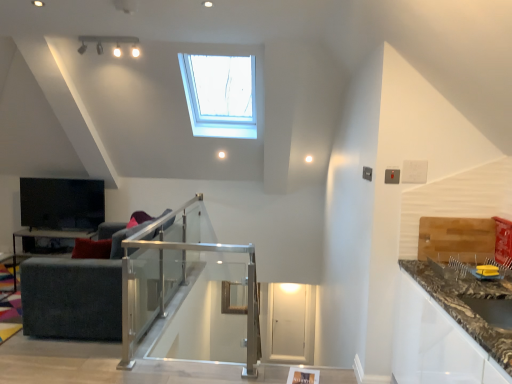
What is the approximate width of matte black table at lower left?

matte black table at lower left is 50.41 centimeters in width.

Measure the distance between dark gray fabric couch at left and camera.

A distance of 10.66 feet exists between dark gray fabric couch at left and camera.

Locate an element on the screen. The width and height of the screenshot is (512, 384). matte black table at lower left is located at coordinates (49, 235).

Locate an element on the screen. glass door behind the dark gray fabric couch at left is located at coordinates (288, 319).

Which of these two, dark gray fabric couch at left or transparent glass door at center, is smaller?

transparent glass door at center is smaller.

Is dark gray fabric couch at left in front of transparent glass door at center?

Yes.

From the image's perspective, would you say transparent glass door at center is shown under clear glass balustrade at center?

Yes, from the image's perspective, transparent glass door at center is beneath clear glass balustrade at center.

Can you tell me how much transparent glass door at center and clear glass balustrade at center differ in facing direction?

They differ by 1.38 degrees in their facing directions.

Who is shorter, transparent glass door at center or clear glass balustrade at center?

transparent glass door at center.

Is transparent glass door at center beside dark gray fabric couch at left?

No, transparent glass door at center is not making contact with dark gray fabric couch at left.

I want to click on glass door on the right of dark gray fabric couch at left, so click(x=288, y=319).

Is transparent glass door at center positioned with its back to dark gray fabric couch at left?

No, dark gray fabric couch at left is not at the back of transparent glass door at center.

Is transparent glass door at center thinner than dark gray fabric couch at left?

Indeed, transparent glass door at center has a lesser width compared to dark gray fabric couch at left.

From a real-world perspective, between clear glass balustrade at center and marble-patterned countertop at lower right, who is vertically higher?

marble-patterned countertop at lower right, from a real-world perspective.

Is clear glass balustrade at center beside marble-patterned countertop at lower right?

No, clear glass balustrade at center is not beside marble-patterned countertop at lower right.

How many degrees apart are the facing directions of clear glass balustrade at center and marble-patterned countertop at lower right?

clear glass balustrade at center and marble-patterned countertop at lower right are facing 91.6 degrees away from each other.

Is clear glass balustrade at center wider or thinner than marble-patterned countertop at lower right?

In the image, clear glass balustrade at center appears to be more narrow than marble-patterned countertop at lower right.

In terms of size, does clear glass balustrade at center appear bigger or smaller than transparent glass door at center?

In the image, clear glass balustrade at center appears to be larger than transparent glass door at center.

From the image's perspective, which is below, clear glass balustrade at center or transparent glass door at center?

transparent glass door at center appears lower in the image.

How different are the orientations of clear glass balustrade at center and transparent glass door at center in degrees?

The angle between the facing direction of clear glass balustrade at center and the facing direction of transparent glass door at center is 1.38 degrees.

In the scene shown: Is transparent glass door at center looking in the opposite direction of marble-patterned countertop at lower right?

No, transparent glass door at center is not facing the opposite direction of marble-patterned countertop at lower right.

Is transparent glass door at center wider than marble-patterned countertop at lower right?

Incorrect, the width of transparent glass door at center does not surpass that of marble-patterned countertop at lower right.

From the image's perspective, which is below, transparent glass door at center or marble-patterned countertop at lower right?

transparent glass door at center.

Which of these two, transparent glass door at center or marble-patterned countertop at lower right, stands shorter?

Standing shorter between the two is transparent glass door at center.

From a real-world perspective, is matte black table at lower left physically located above or below dark gray fabric couch at left?

matte black table at lower left is below dark gray fabric couch at left.

Is matte black table at lower left surrounding dark gray fabric couch at left?

No.

Can you confirm if matte black table at lower left is taller than dark gray fabric couch at left?

Incorrect, the height of matte black table at lower left is not larger of that of dark gray fabric couch at left.

Identify the location of studio couch located above the transparent glass door at center (from the image's perspective). The image size is (512, 384). (75, 295).

Identify the location of balustrade above the transparent glass door at center (from a real-world perspective). The image size is (512, 384). pyautogui.click(x=184, y=250).

Looking at the image, which one is located closer to dark gray fabric couch at left, clear glass balustrade at center or matte black table at lower left?

clear glass balustrade at center lies closer to dark gray fabric couch at left than the other object.

When comparing their distances from clear glass balustrade at center, does dark gray fabric couch at left or transparent glass door at center seem closer?

dark gray fabric couch at left.

Estimate the real-world distances between objects in this image. Which object is further from dark gray fabric couch at left, matte black table at lower left or marble-patterned countertop at lower right?

marble-patterned countertop at lower right lies further to dark gray fabric couch at left than the other object.

In the scene shown: Which object lies further to the anchor point matte black table at lower left, dark gray fabric couch at left or marble-patterned countertop at lower right?

marble-patterned countertop at lower right.

Considering their positions, is clear glass balustrade at center positioned further to marble-patterned countertop at lower right than matte black table at lower left?

matte black table at lower left lies further to marble-patterned countertop at lower right than the other object.

When comparing their distances from dark gray fabric couch at left, does transparent glass door at center or matte black table at lower left seem closer?

Among the two, matte black table at lower left is located nearer to dark gray fabric couch at left.

Based on their spatial positions, is matte black table at lower left or transparent glass door at center closer to marble-patterned countertop at lower right?

transparent glass door at center lies closer to marble-patterned countertop at lower right than the other object.

Looking at this image, which object lies nearer to the anchor point matte black table at lower left, clear glass balustrade at center or dark gray fabric couch at left?

dark gray fabric couch at left.

Where is `studio couch between marble-patterned countertop at lower right and transparent glass door at center from front to back`? The height and width of the screenshot is (384, 512). studio couch between marble-patterned countertop at lower right and transparent glass door at center from front to back is located at coordinates (75, 295).

Locate an element on the screen. This screenshot has width=512, height=384. studio couch positioned between clear glass balustrade at center and transparent glass door at center from near to far is located at coordinates (75, 295).

Where is `table between marble-patterned countertop at lower right and transparent glass door at center from front to back`? This screenshot has height=384, width=512. table between marble-patterned countertop at lower right and transparent glass door at center from front to back is located at coordinates (49, 235).

At what (x,y) coordinates should I click in order to perform the action: click on balustrade between dark gray fabric couch at left and marble-patterned countertop at lower right in the horizontal direction. Please return your answer as a coordinate pair (x, y). This screenshot has width=512, height=384. Looking at the image, I should click on pyautogui.click(x=184, y=250).